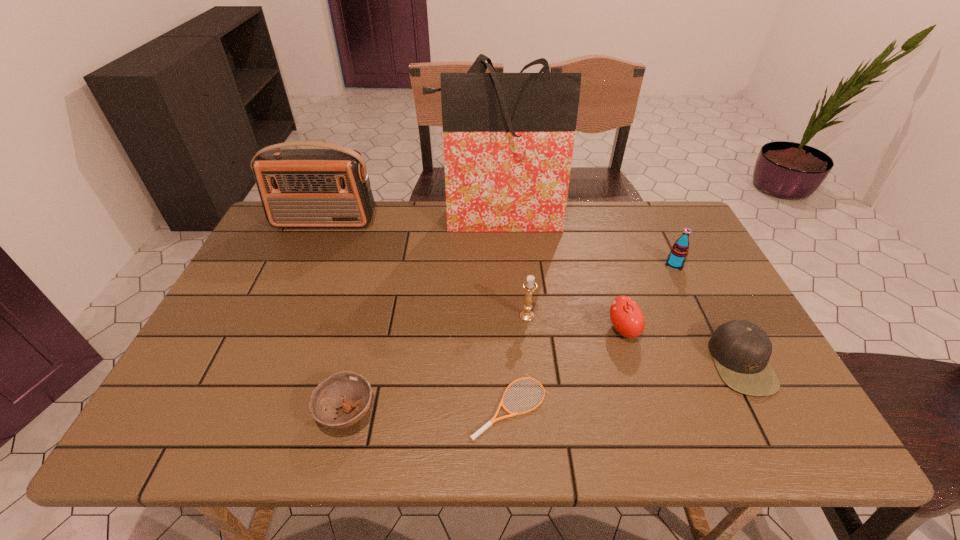
I want to click on radio receiver that is at the far edge, so click(x=310, y=187).

This screenshot has width=960, height=540. I want to click on bowl present at the near edge, so 346,389.

This screenshot has width=960, height=540. I want to click on tennis racket that is positioned at the near edge, so click(x=493, y=420).

Find the location of a particular element. object located at the left edge is located at coordinates (310, 187).

Image resolution: width=960 pixels, height=540 pixels. Identify the location of soda at the right edge. (679, 251).

Find the location of a particular element. Image resolution: width=960 pixels, height=540 pixels. cap present at the right edge is located at coordinates (741, 350).

Find the location of a particular element. The height and width of the screenshot is (540, 960). object at the far left corner is located at coordinates (310, 187).

In the image, there is a desktop. What are the coordinates of `free space at the far edge` in the screenshot? It's located at (417, 202).

In the image, there is a desktop. Where is `vacant space at the near edge`? This screenshot has height=540, width=960. vacant space at the near edge is located at coordinates (444, 444).

Identify the location of vacant space at the left edge of the desktop. This screenshot has height=540, width=960. (265, 309).